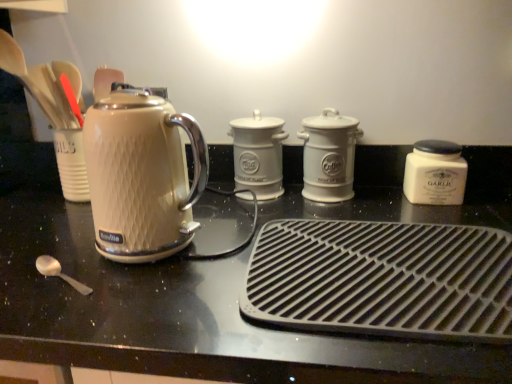
Image resolution: width=512 pixels, height=384 pixels. I want to click on free region under matte cream kettle at left (from a real-world perspective), so click(178, 251).